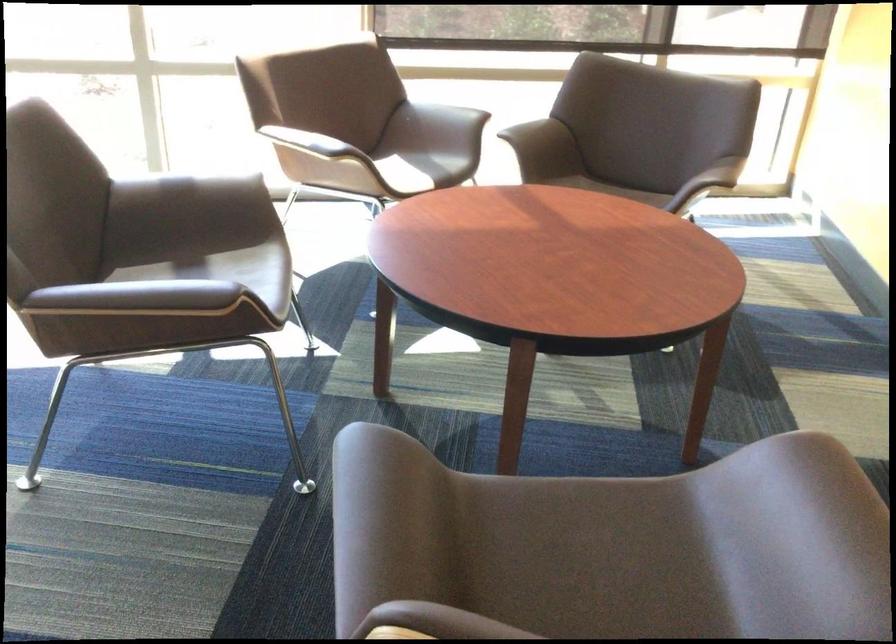
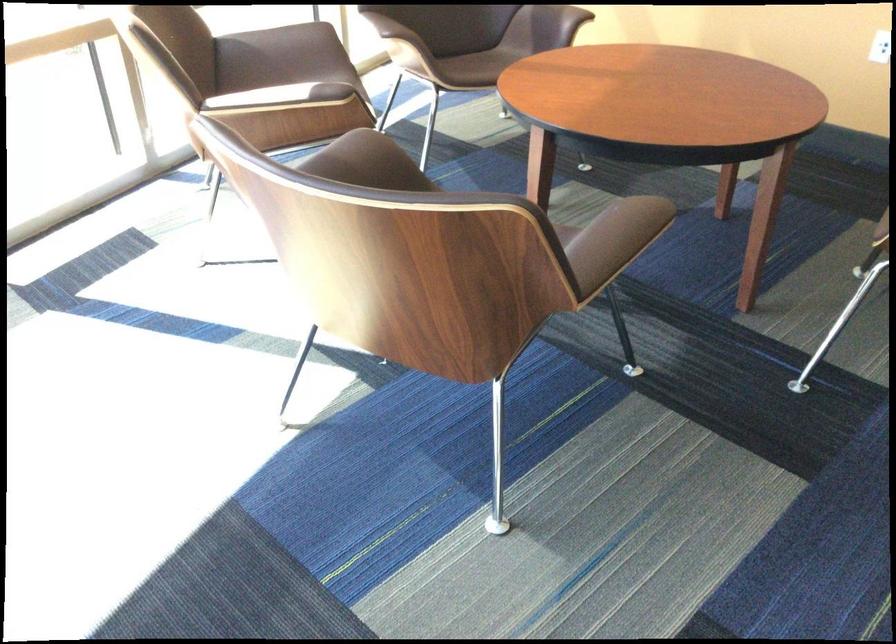
The point at (147, 299) is marked in the first image. Where is the corresponding point in the second image?

(614, 240)